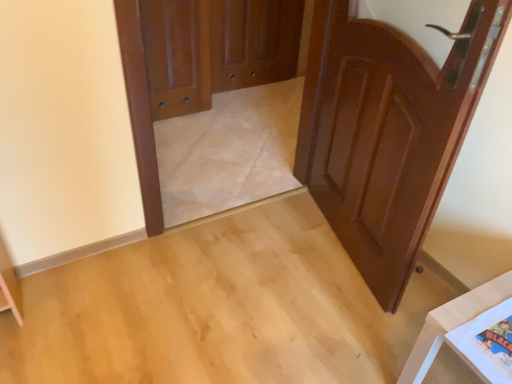
Find the location of a particular element. The height and width of the screenshot is (384, 512). free space on the front side of polished wood door at upper left, the 2th door from the right is located at coordinates (184, 134).